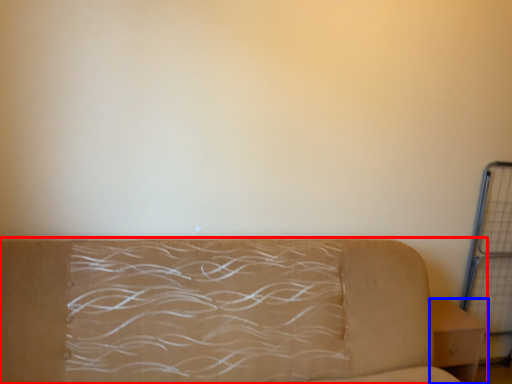
Question: Among these objects, which one is farthest to the camera, studio couch (highlighted by a red box) or furniture (highlighted by a blue box)?

Choices:
 (A) studio couch
 (B) furniture

Answer: (B)